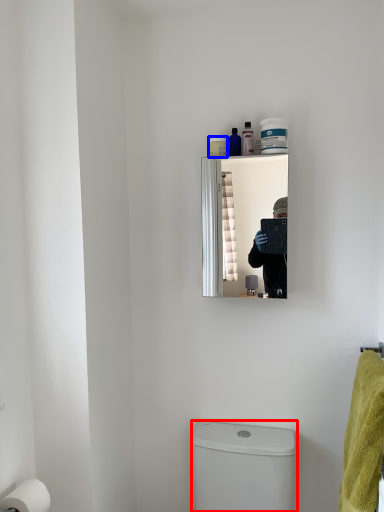
Question: Which point is further to the camera, toilet bowl (highlighted by a red box) or toiletry (highlighted by a blue box)?

Choices:
 (A) toilet bowl
 (B) toiletry

Answer: (B)